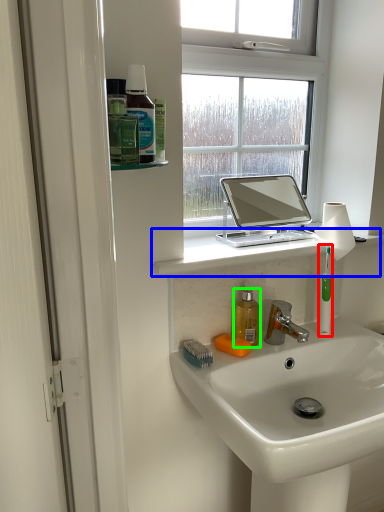
Question: Estimate the real-world distances between objects in this image. Which object is farther from toothbrush (highlighted by a red box), window sill (highlighted by a blue box) or mouthwash (highlighted by a green box)?

Choices:
 (A) window sill
 (B) mouthwash

Answer: (A)